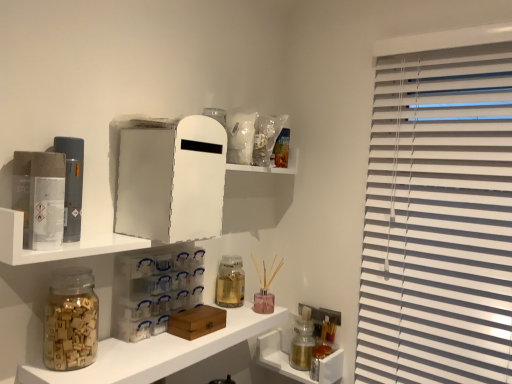
What do you see at coordinates (155, 291) in the screenshot? This screenshot has width=512, height=384. I see `transparent plastic drawers at center, the 1th cabinet positioned from the front` at bounding box center [155, 291].

What is the approximate height of transparent glass jar at lower left?

7.37 inches.

Describe the element at coordinates (288, 360) in the screenshot. I see `metallic silver canisters at lower right, the 2th cabinet positioned from the left` at that location.

This screenshot has height=384, width=512. What are the coordinates of `white matte medicine cabinet at upper center` in the screenshot? It's located at (170, 181).

Describe the element at coordinates (170, 181) in the screenshot. I see `white matte medicine cabinet at upper center` at that location.

This screenshot has width=512, height=384. I want to click on translucent glass jar at lower left, the 2th shelf when ordered from top to bottom, so click(158, 352).

Is the surface of white plastic shelf at upper left, the 1th shelf viewed from the top, in direct contact with translucent glass bottle at lower right, which is the 2th bottle from top to bottom?

No, white plastic shelf at upper left, the 1th shelf viewed from the top, is not touching translucent glass bottle at lower right, which is the 2th bottle from top to bottom.

Considering the points (39, 255) and (301, 344), which point is behind, point (39, 255) or point (301, 344)?

The point (301, 344) is farther from the camera.

How many degrees apart are the facing directions of white plastic shelf at upper left, which is the second shelf in bottom-to-top order, and translucent glass bottle at lower right, marked as the first bottle in a right-to-left arrangement?

white plastic shelf at upper left, which is the second shelf in bottom-to-top order, and translucent glass bottle at lower right, marked as the first bottle in a right-to-left arrangement, are facing 88.1 degrees away from each other.

In the scene shown: Between white plastic shelf at upper left, the 1th shelf viewed from the top, and translucent glass bottle at lower right, marked as the first bottle in a right-to-left arrangement, which one appears on the right side from the viewer's perspective?

translucent glass bottle at lower right, marked as the first bottle in a right-to-left arrangement, is more to the right.

Is white matte medicine cabinet at upper center aimed at translucent glass jar at lower left, the 2th shelf when ordered from top to bottom?

No, white matte medicine cabinet at upper center is not facing towards translucent glass jar at lower left, the 2th shelf when ordered from top to bottom.

From their relative heights in the image, would you say white matte medicine cabinet at upper center is taller or shorter than translucent glass jar at lower left, which is the 1th shelf in bottom-to-top order?

white matte medicine cabinet at upper center is taller than translucent glass jar at lower left, which is the 1th shelf in bottom-to-top order.

Which is more to the right, white matte medicine cabinet at upper center or translucent glass jar at lower left, the 2th shelf when ordered from top to bottom?

From the viewer's perspective, translucent glass jar at lower left, the 2th shelf when ordered from top to bottom, appears more on the right side.

Is translucent glass bottle at lower right, which appears as the 1th bottle when ordered from the bottom, touching transparent glass jar at lower left?

No, translucent glass bottle at lower right, which appears as the 1th bottle when ordered from the bottom, is not in contact with transparent glass jar at lower left.

How many degrees apart are the facing directions of translucent glass bottle at lower right, which is the 2th bottle from top to bottom, and transparent glass jar at lower left?

There is a 95.7-degree angle between the facing directions of translucent glass bottle at lower right, which is the 2th bottle from top to bottom, and transparent glass jar at lower left.

Is translucent glass bottle at lower right, which is the first bottle in back-to-front order, wider than transparent glass jar at lower left?

No.

Could you tell me if translucent glass bottle at lower right, the 2th bottle when ordered from front to back, is turned towards transparent plastic drawers at center, the second cabinet in the right-to-left sequence?

Yes, translucent glass bottle at lower right, the 2th bottle when ordered from front to back, is turned towards transparent plastic drawers at center, the second cabinet in the right-to-left sequence.

Which object is wider, translucent glass bottle at lower right, the 2th bottle when ordered from front to back, or transparent plastic drawers at center, which is the second cabinet from back to front?

With larger width is translucent glass bottle at lower right, the 2th bottle when ordered from front to back.

This screenshot has height=384, width=512. What are the coordinates of `cabinet that is the 2nd one when counting forward from the translucent glass bottle at lower right, which appears as the 1th bottle when ordered from the bottom` in the screenshot? It's located at (155, 291).

Is translucent glass bottle at lower right, the second bottle viewed from the left, at the right side of transparent plastic drawers at center, positioned as the second cabinet in bottom-to-top order?

Yes.

From the image's perspective, does translucent glass jar at lower left, which is the 1th shelf in bottom-to-top order, appear lower than white matte medicine cabinet at upper center?

Yes.

Find the location of a particular element. The width and height of the screenshot is (512, 384). shelf that is the 2nd object located below the white matte medicine cabinet at upper center (from the image's perspective) is located at coordinates (158, 352).

From the picture: Is translucent glass jar at lower left, the 2th shelf when ordered from top to bottom, wider than white matte medicine cabinet at upper center?

Yes.

Does transparent glass jar at lower left touch translucent glass jar at center, which is the 1th bottle in top-to-bottom order?

There is a gap between transparent glass jar at lower left and translucent glass jar at center, which is the 1th bottle in top-to-bottom order.

Considering the positions of objects transparent glass jar at lower left and translucent glass jar at center, which appears as the 2th bottle when viewed from the right, in the image provided, who is more to the left, transparent glass jar at lower left or translucent glass jar at center, which appears as the 2th bottle when viewed from the right,?

transparent glass jar at lower left.

Looking at this image, is translucent glass jar at center, which appears as the 1th bottle when viewed from the front, located within transparent glass jar at lower left?

Definitely not — translucent glass jar at center, which appears as the 1th bottle when viewed from the front, is not inside transparent glass jar at lower left.

Where is `bottle that is the 1st one below the transparent glass jar at lower left (from a real-world perspective)`? The image size is (512, 384). bottle that is the 1st one below the transparent glass jar at lower left (from a real-world perspective) is located at coordinates (230, 282).

From the image's perspective, relative to white plastic shelf at upper left, the 1th shelf viewed from the top, is transparent plastic drawers at center, which is the first cabinet from left to right, above or below?

transparent plastic drawers at center, which is the first cabinet from left to right, is situated lower than white plastic shelf at upper left, the 1th shelf viewed from the top, in the image.

Is transparent plastic drawers at center, which is the first cabinet from left to right, oriented away from white plastic shelf at upper left, which is the second shelf in bottom-to-top order?

transparent plastic drawers at center, which is the first cabinet from left to right, is not turned away from white plastic shelf at upper left, which is the second shelf in bottom-to-top order.

From a real-world perspective, is transparent plastic drawers at center, which is the first cabinet from left to right, located beneath white plastic shelf at upper left, which is the second shelf in bottom-to-top order?

Yes.

The width and height of the screenshot is (512, 384). Find the location of `shelf that is the 2nd object located above the translucent glass bottle at lower right, which is the first bottle in back-to-front order (from the image's perspective)`. shelf that is the 2nd object located above the translucent glass bottle at lower right, which is the first bottle in back-to-front order (from the image's perspective) is located at coordinates (62, 243).

At what (x,y) coordinates should I click in order to perform the action: click on medicine cabinet that appears above the translucent glass jar at lower left, the 2th shelf when ordered from top to bottom (from a real-world perspective). Please return your answer as a coordinate pair (x, y). This screenshot has width=512, height=384. Looking at the image, I should click on (170, 181).

Based on their spatial positions, is transparent plastic drawers at center, which is the second cabinet from back to front, or translucent glass bottle at lower right, which appears as the 1th bottle when ordered from the bottom, further from white matte medicine cabinet at upper center?

Based on the image, translucent glass bottle at lower right, which appears as the 1th bottle when ordered from the bottom, appears to be further to white matte medicine cabinet at upper center.

In the scene shown: Considering their positions, is translucent glass bottle at lower right, the 2th bottle when ordered from front to back, positioned further to transparent plastic drawers at center, the second cabinet in the right-to-left sequence, than metallic silver canisters at lower right, marked as the 1th cabinet in a right-to-left arrangement?

Among the two, translucent glass bottle at lower right, the 2th bottle when ordered from front to back, is located further to transparent plastic drawers at center, the second cabinet in the right-to-left sequence.

From the image, which object appears to be farther from transparent glass jar at lower left, white matte medicine cabinet at upper center or transparent plastic drawers at center, which is the first cabinet from left to right?

The object further to transparent glass jar at lower left is white matte medicine cabinet at upper center.

Looking at the image, which one is located closer to translucent glass jar at lower left, which is the 1th shelf in bottom-to-top order, white plastic shelf at upper left, which is the second shelf in bottom-to-top order, or translucent glass bottle at lower right, which appears as the 1th bottle when ordered from the bottom?

Based on the image, white plastic shelf at upper left, which is the second shelf in bottom-to-top order, appears to be nearer to translucent glass jar at lower left, which is the 1th shelf in bottom-to-top order.

Based on their spatial positions, is translucent glass bottle at lower right, which is the first bottle in back-to-front order, or translucent glass jar at lower left, which is the 1th shelf in bottom-to-top order, further from translucent glass jar at center, which ranks as the second bottle in back-to-front order?

Based on the image, translucent glass bottle at lower right, which is the first bottle in back-to-front order, appears to be further to translucent glass jar at center, which ranks as the second bottle in back-to-front order.

Estimate the real-world distances between objects in this image. Which object is closer to white matte medicine cabinet at upper center, translucent glass jar at center, which ranks as the second bottle in back-to-front order, or transparent glass jar at lower left?

transparent glass jar at lower left lies closer to white matte medicine cabinet at upper center than the other object.

From the image, which object appears to be nearer to transparent plastic drawers at center, which is the second cabinet from back to front, translucent glass jar at center, placed as the first bottle when sorted from left to right, or translucent glass bottle at lower right, the 2th bottle when ordered from front to back?

Among the two, translucent glass jar at center, placed as the first bottle when sorted from left to right, is located nearer to transparent plastic drawers at center, which is the second cabinet from back to front.

Estimate the real-world distances between objects in this image. Which object is further from white plastic shelf at upper left, which is the second shelf in bottom-to-top order, translucent glass jar at center, which is the 1th bottle in top-to-bottom order, or metallic silver canisters at lower right, the 2th cabinet positioned from the left?

Among the two, metallic silver canisters at lower right, the 2th cabinet positioned from the left, is located further to white plastic shelf at upper left, which is the second shelf in bottom-to-top order.

Identify the location of cabinet between translucent glass jar at lower left, the 2th shelf when ordered from top to bottom, and metallic silver canisters at lower right, which is counted as the 1th cabinet, starting from the back, along the z-axis. This screenshot has height=384, width=512. pyautogui.click(x=155, y=291).

Identify the location of cabinet positioned between white plastic shelf at upper left, the 1th shelf viewed from the top, and metallic silver canisters at lower right, marked as the 1th cabinet in a right-to-left arrangement, from near to far. tap(155, 291).

Locate an element on the screen. medicine cabinet between transparent glass jar at lower left and translucent glass jar at center, which is the 1th bottle in top-to-bottom order, along the z-axis is located at coordinates (170, 181).

I want to click on medicine cabinet between translucent glass jar at lower left, which is the 1th shelf in bottom-to-top order, and translucent glass bottle at lower right, which appears as the 1th bottle when ordered from the bottom, along the z-axis, so click(170, 181).